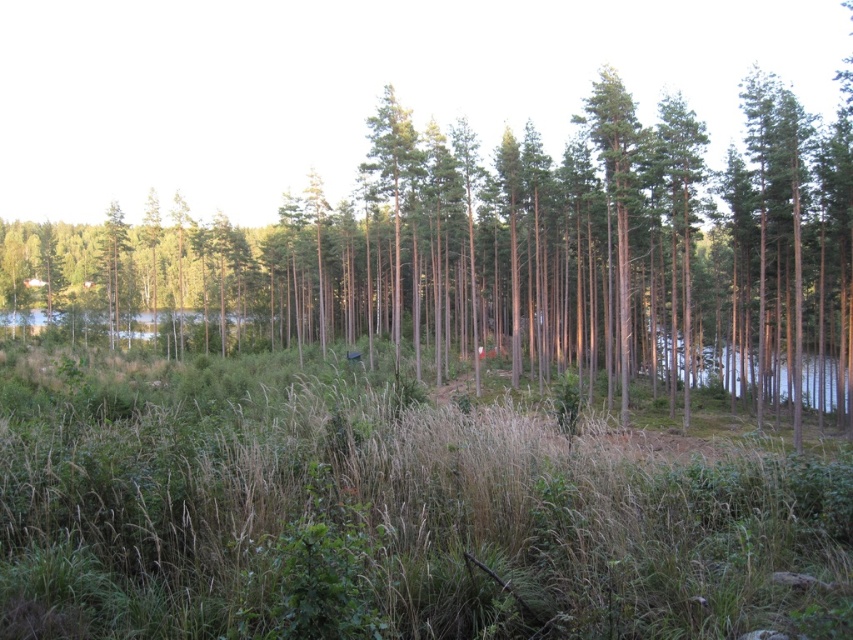
Does green grass at center have a lesser height compared to green smooth tree at center?

Correct, green grass at center is not as tall as green smooth tree at center.

Is green grass at center to the right of green smooth tree at center from the viewer's perspective?

In fact, green grass at center is to the left of green smooth tree at center.

Locate an element on the screen. This screenshot has width=853, height=640. green grass at center is located at coordinates (393, 516).

Identify the location of green grass at center. (393, 516).